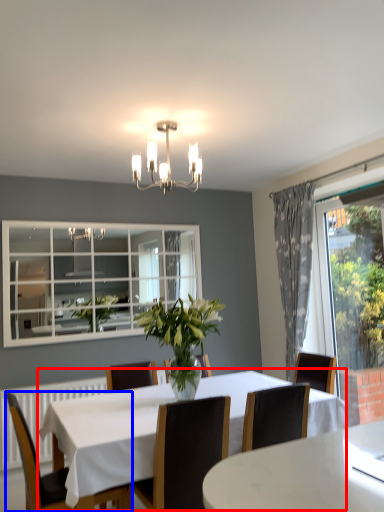
Question: Which point is closer to the camera, kitchen & dining room table (highlighted by a red box) or chair (highlighted by a blue box)?

Choices:
 (A) kitchen & dining room table
 (B) chair

Answer: (A)